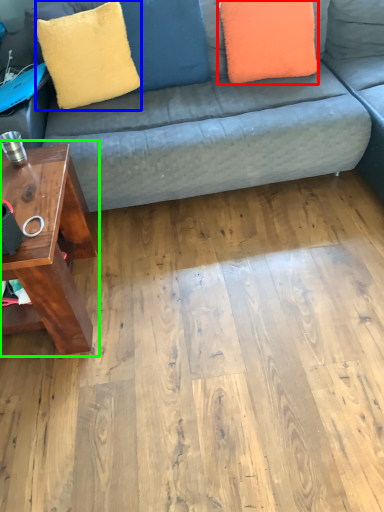
Question: Which object is positioned farthest from pillow (highlighted by a red box)? Select from throw pillow (highlighted by a blue box) and table (highlighted by a green box).

Choices:
 (A) throw pillow
 (B) table

Answer: (B)